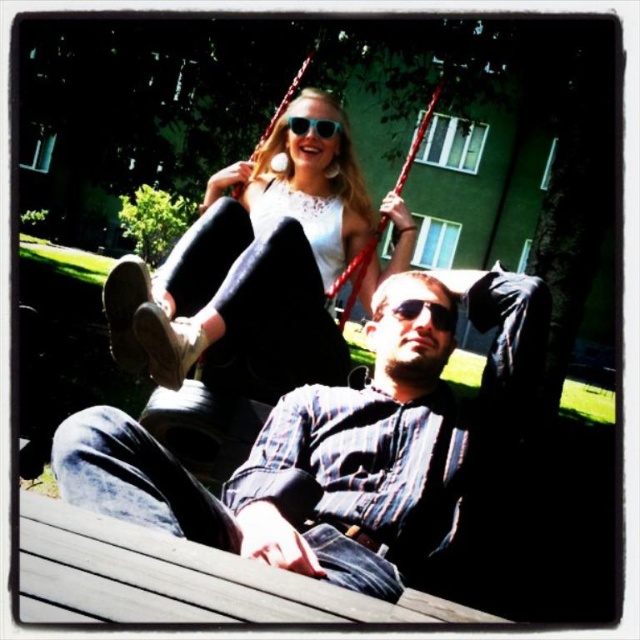
Question: Can you confirm if denim jeans at center is thinner than matte white blouse at upper center?

Choices:
 (A) yes
 (B) no

Answer: (B)

Question: Which point is farther from the camera taking this photo?

Choices:
 (A) (289, 124)
 (B) (368, 474)
 (C) (301, 188)

Answer: (C)

Question: Which point is closer to the camera?

Choices:
 (A) (211, 243)
 (B) (305, 124)
 (C) (378, 508)

Answer: (C)

Question: Is denim jeans at center thinner than sunglasses at upper center?

Choices:
 (A) no
 (B) yes

Answer: (A)

Question: Does denim jeans at center have a lesser width compared to matte white blouse at upper center?

Choices:
 (A) yes
 (B) no

Answer: (B)

Question: Considering the real-world distances, which object is farthest from the sunglasses at upper center?

Choices:
 (A) matte white blouse at upper center
 (B) denim jeans at center

Answer: (B)